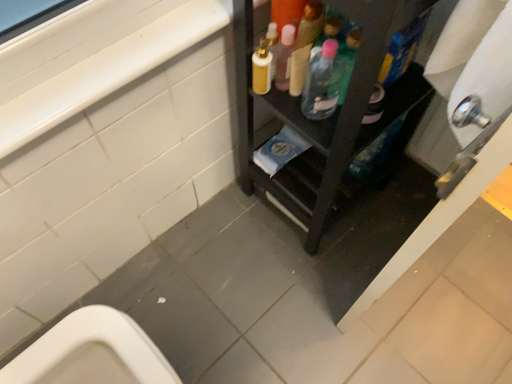
Image resolution: width=512 pixels, height=384 pixels. In order to click on free location in front of black wood shelf at center in this screenshot , I will do pos(300,284).